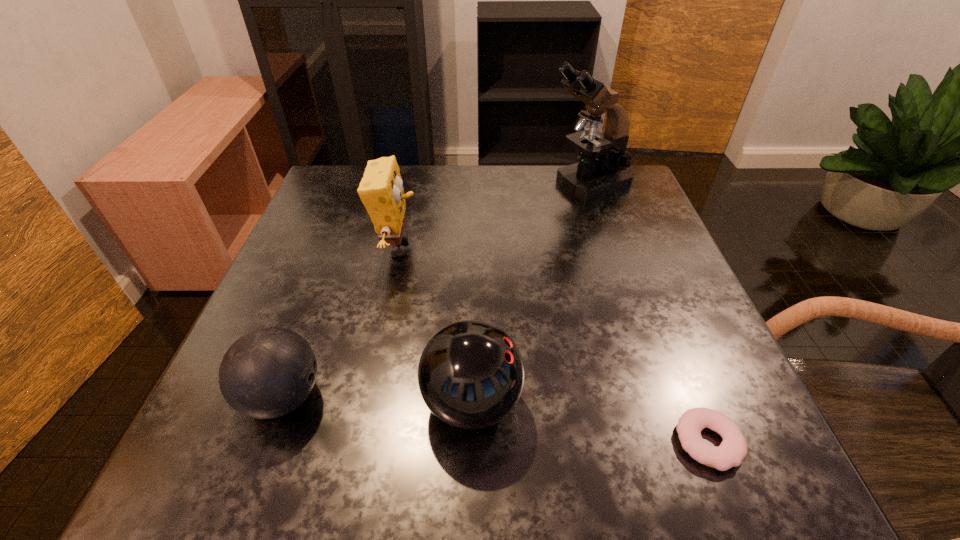
I want to click on empty location between the farthest object and the shortest object, so click(x=648, y=313).

Where is `unoccupied position between the shorter bowling ball and the tallest object`? unoccupied position between the shorter bowling ball and the tallest object is located at coordinates (435, 290).

Find the location of a particular element. The width and height of the screenshot is (960, 540). empty location between the doughnut and the microscope is located at coordinates (648, 313).

The image size is (960, 540). I want to click on empty location between the doughnut and the third object from left to right, so click(590, 422).

Identify which object is the fourth closest to the second object from left to right. Please provide its 2D coordinates. Your answer should be formatted as a tuple, i.e. [(x, y)], where the tuple contains the x and y coordinates of a point satisfying the conditions above.

[(733, 449)]

Locate an element on the screen. the second closest object relative to the right bowling ball is located at coordinates (381, 191).

Locate an element on the screen. Image resolution: width=960 pixels, height=540 pixels. free space that satisfies the following two spatial constraints: 1. on the face of the fourth shortest object; 2. on the back side of the shortest object is located at coordinates (357, 442).

You are a GUI agent. You are given a task and a screenshot of the screen. Output one action in this format:
    pyautogui.click(x=<x>, y=<y>)
    Task: Click on the free space that satisfies the following two spatial constraints: 1. on the front side of the farthest object; 2. on the grip area of the left bowling ball
    The height and width of the screenshot is (540, 960).
    Given the screenshot: What is the action you would take?
    pyautogui.click(x=659, y=397)

Where is `vacant area that satisfies the following two spatial constraints: 1. on the front side of the farthest object; 2. on the surface of the right bowling ball near the finger holes`? This screenshot has width=960, height=540. vacant area that satisfies the following two spatial constraints: 1. on the front side of the farthest object; 2. on the surface of the right bowling ball near the finger holes is located at coordinates point(660,403).

At what (x,y) coordinates should I click in order to perform the action: click on free space that satisfies the following two spatial constraints: 1. on the face of the doughnut; 2. on the left side of the second farthest object. Please return your answer as a coordinate pair (x, y). Looking at the image, I should click on (357, 442).